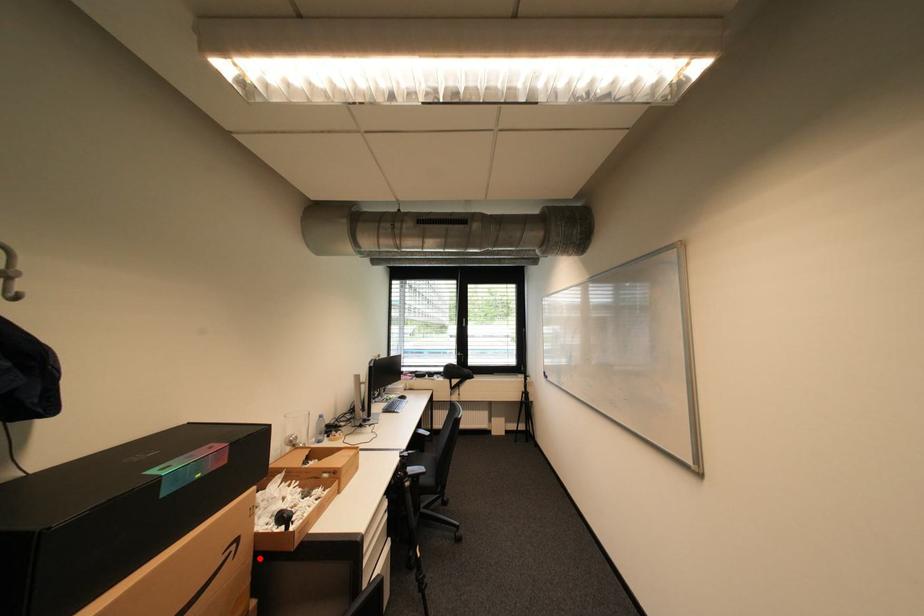
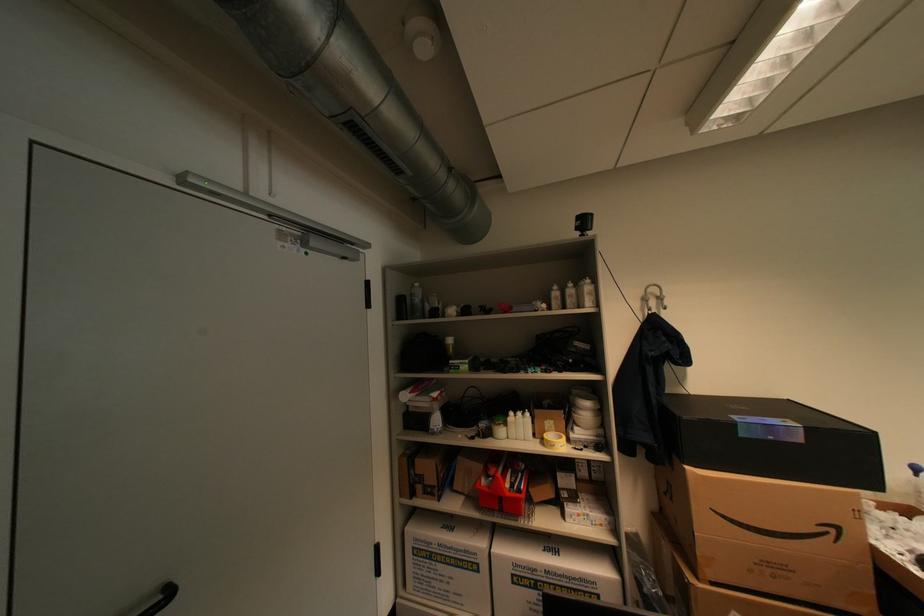
Question: A red point is marked in image1. In image2, is the corresponding 3D point closer to the camera or farther? Reply with the corresponding letter.

Choices:
 (A) The corresponding 3D point is closer.
 (B) The corresponding 3D point is farther.

Answer: (A)